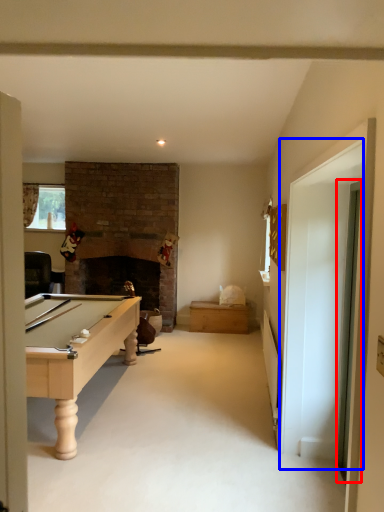
Question: Which object is further to the camera taking this photo, glass door (highlighted by a red box) or glass door (highlighted by a blue box)?

Choices:
 (A) glass door
 (B) glass door

Answer: (A)